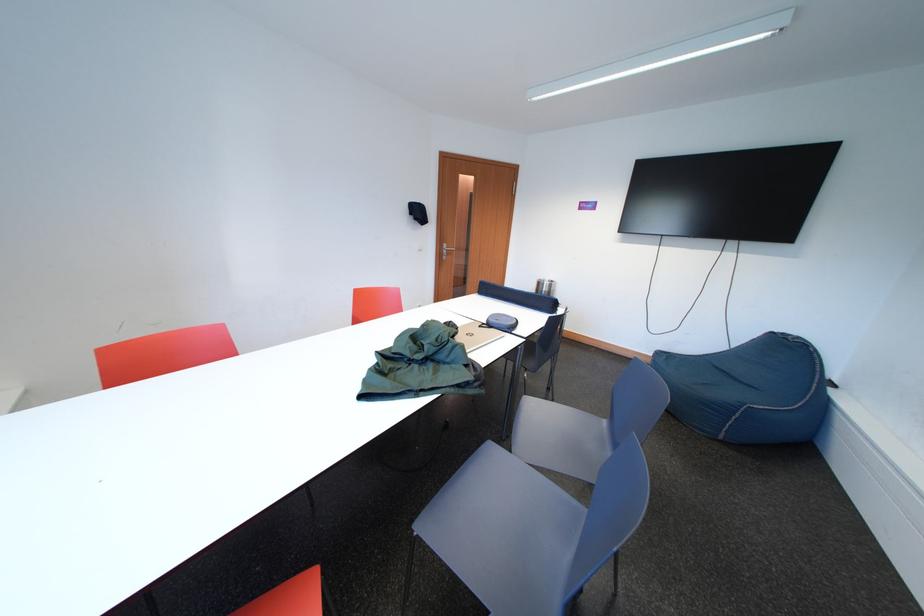
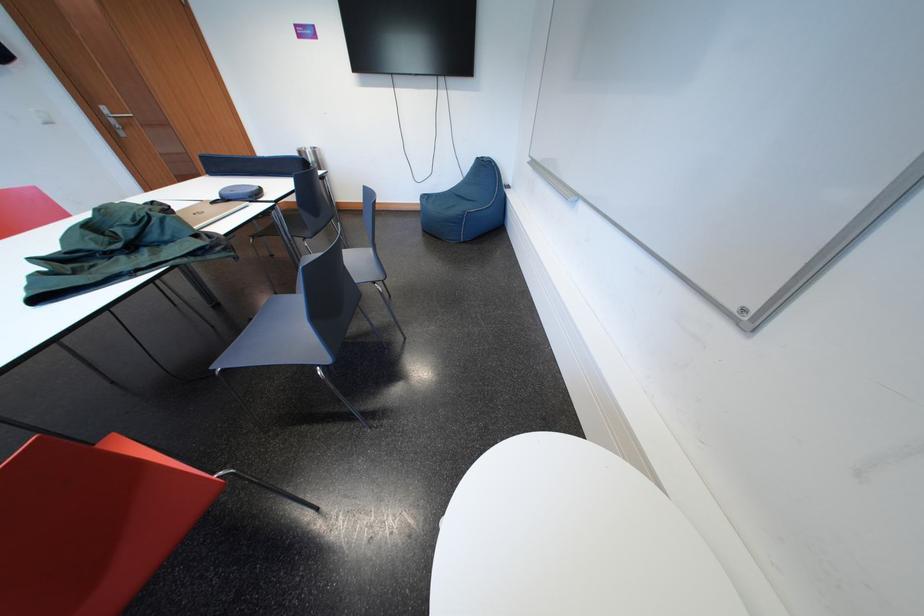
Find the pixel in the second image that matches point (755, 339) in the first image.

(477, 169)